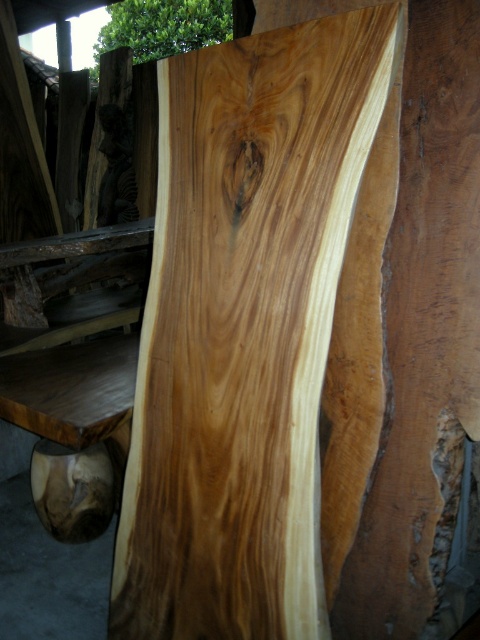
You are a woodcutter standing at the natural wood plank at center and want to reach the green leafy tree at upper center to cut it down. Can you safely walk towards the tree without needing to climb over any obstacles?

The distance between the natural wood plank at center and the green leafy tree at upper center is 3.51 meters. Since there are no obstacles mentioned in the scene description, you can safely walk towards the tree without needing to climb over anything.

You are standing in a lumberyard and see the natural wood plank at center and the green leafy tree at upper center. Which object is positioned higher up in the image?

The green leafy tree at upper center is positioned higher up in the image than the natural wood plank at center.

You are standing in a woodwork shop and see the natural wood plank at center and the green leafy tree at upper center. Which object is positioned to the right side of the other?

The natural wood plank at center is to the right of the green leafy tree at upper center.